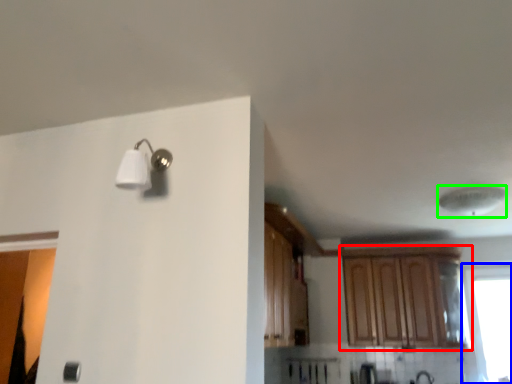
Question: Considering the real-world distances, which object is farthest from cabinetry (highlighted by a red box)? window (highlighted by a blue box) or lamp (highlighted by a green box)?

Choices:
 (A) window
 (B) lamp

Answer: (B)